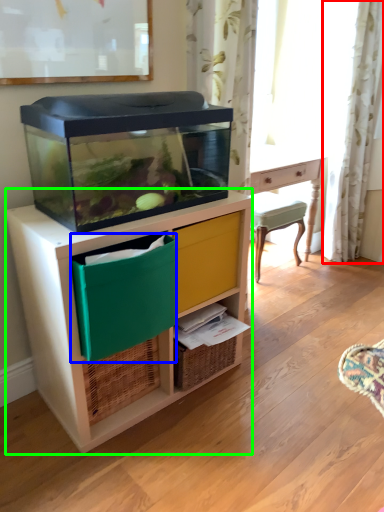
Question: Based on their relative distances, which object is farther from curtain (highlighted by a red box)? Choose from storage box (highlighted by a blue box) and chest of drawers (highlighted by a green box).

Choices:
 (A) storage box
 (B) chest of drawers

Answer: (A)